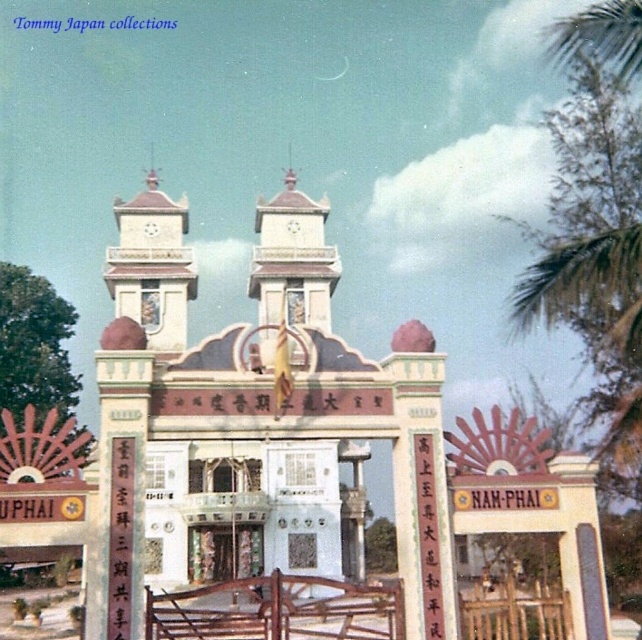
Question: Is white stone clock tower at upper center positioned in front of white stone tower at center?

Choices:
 (A) yes
 (B) no

Answer: (B)

Question: Is white stone clock tower at upper center below white stone tower at center?

Choices:
 (A) no
 (B) yes

Answer: (A)

Question: Can you confirm if white stone clock tower at upper center is positioned to the right of white stone tower at center?

Choices:
 (A) no
 (B) yes

Answer: (A)